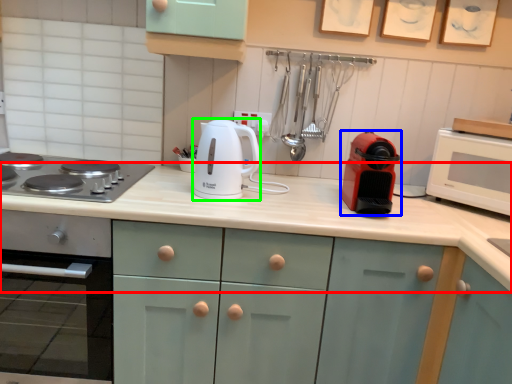
Question: Estimate the real-world distances between objects in this image. Which object is farther from countertop (highlighted by a red box), kitchen appliance (highlighted by a blue box) or kitchen appliance (highlighted by a green box)?

Choices:
 (A) kitchen appliance
 (B) kitchen appliance

Answer: (B)